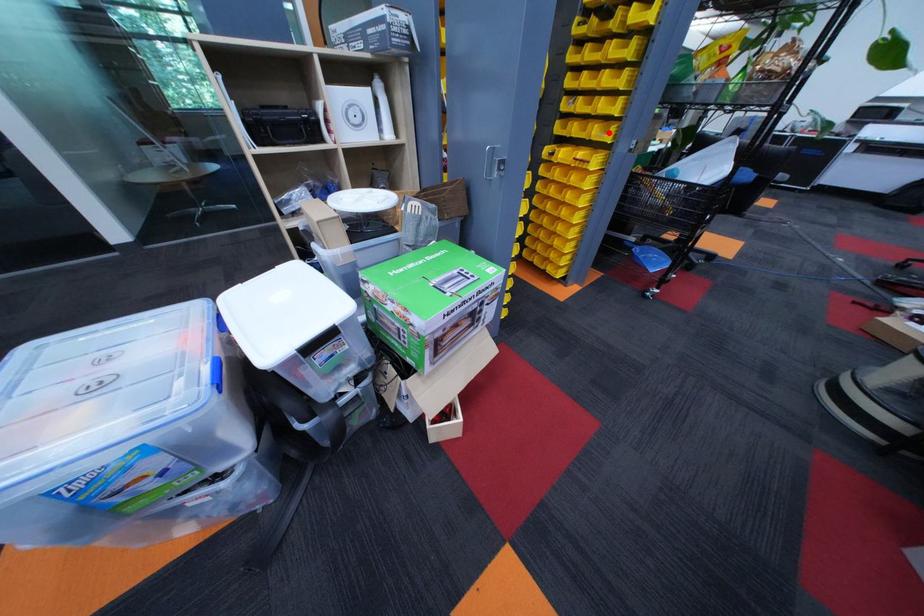
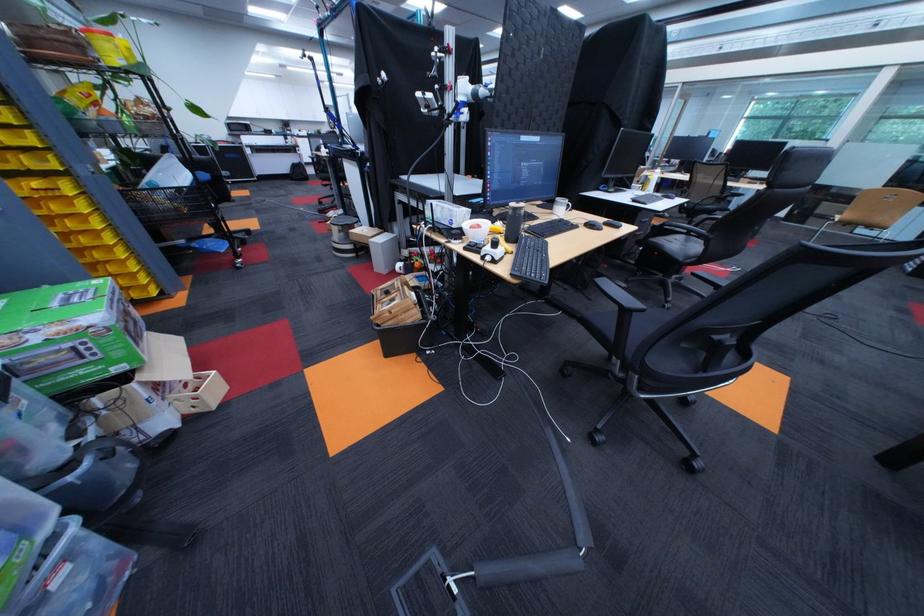
In the second image, find the point that corresponds to the highlighted location in the first image.

(43, 163)